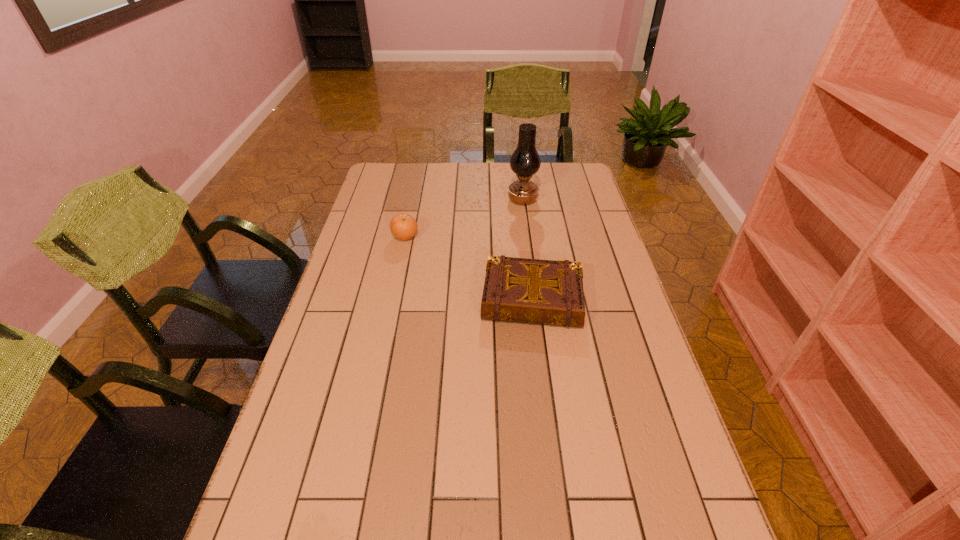
The width and height of the screenshot is (960, 540). Identify the location of empty space between the leftmost object and the shortest object. (468, 268).

Find the location of `object that can be found as the closest to the hardback book`. object that can be found as the closest to the hardback book is located at coordinates (403, 226).

The height and width of the screenshot is (540, 960). What are the coordinates of `object that is the closest to the nearest object` in the screenshot? It's located at (403, 226).

Where is `vacant position in the image that satisfies the following two spatial constraints: 1. on the front side of the orange; 2. on the right side of the shortest object`? vacant position in the image that satisfies the following two spatial constraints: 1. on the front side of the orange; 2. on the right side of the shortest object is located at coordinates (392, 299).